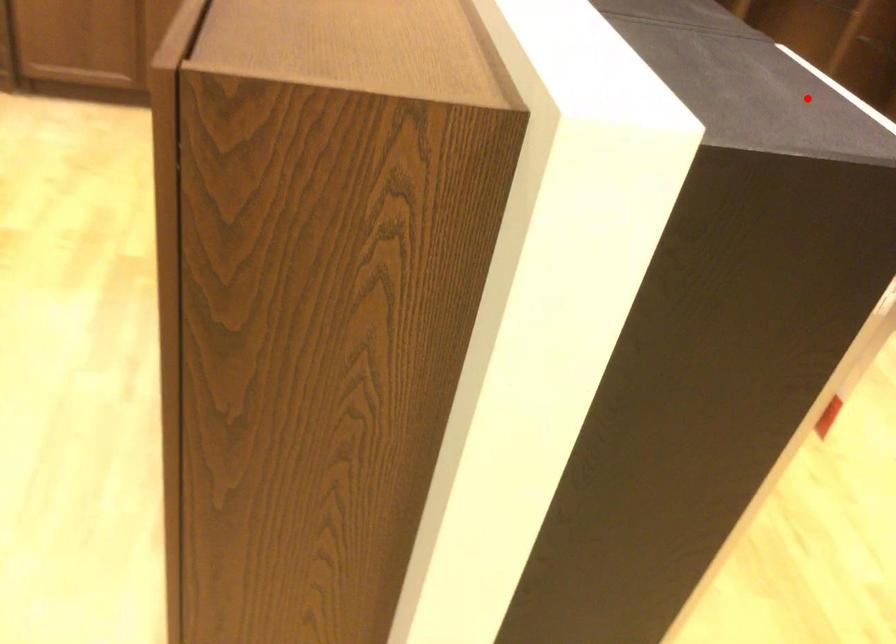
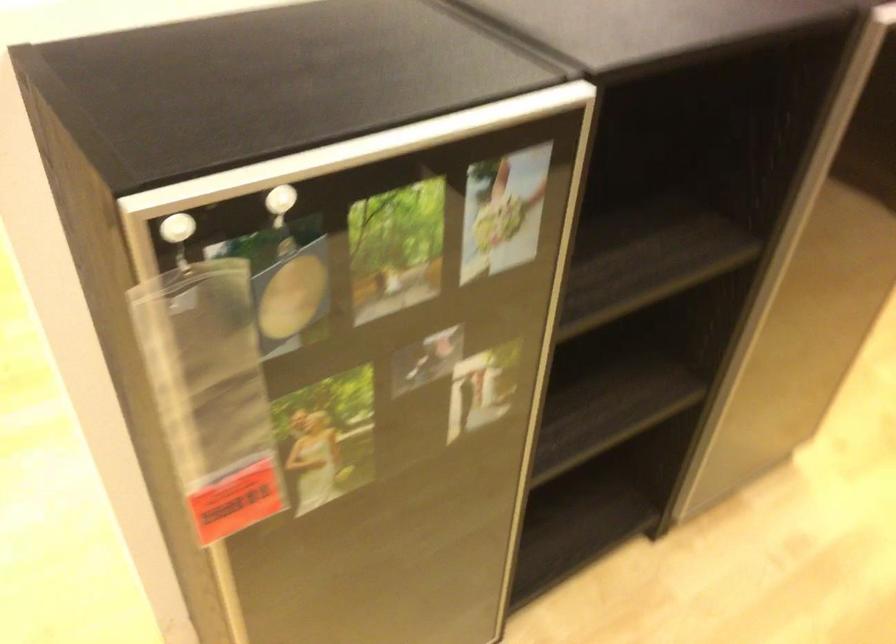
Question: I am providing you with two images of the same scene from different viewpoints. A red point is marked on the first image. Can you still see the location of the red point in image 2?

Choices:
 (A) Yes
 (B) No

Answer: (A)